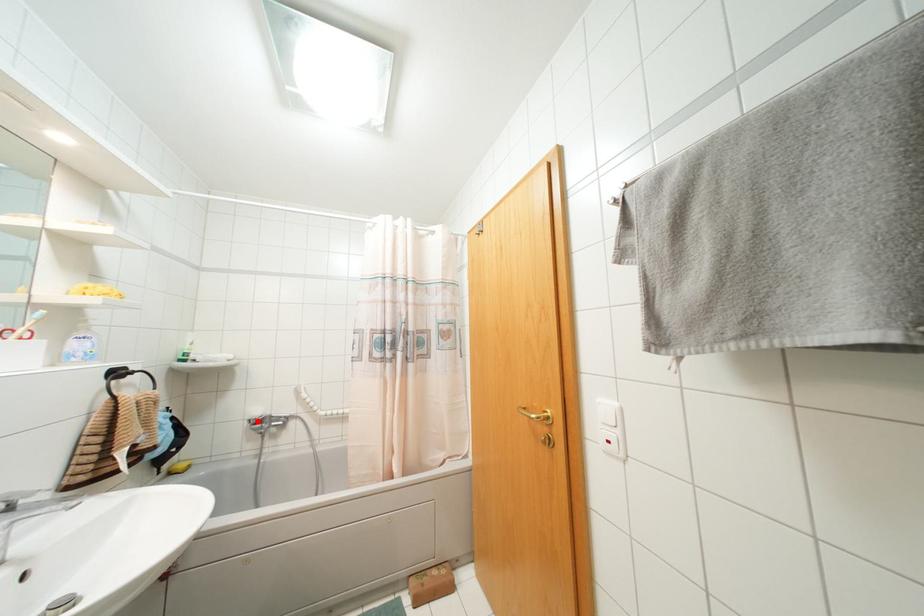
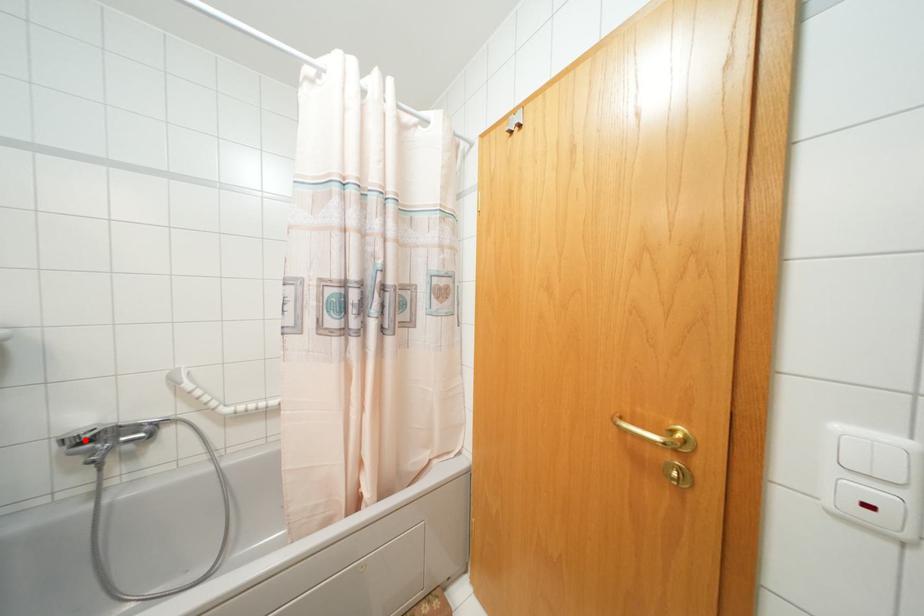
I am providing you with two images of the same scene from different viewpoints. A red point is marked on the first image and another point is marked on the second image. Is the marked point in image1 the same physical position as the marked point in image2?

Yes